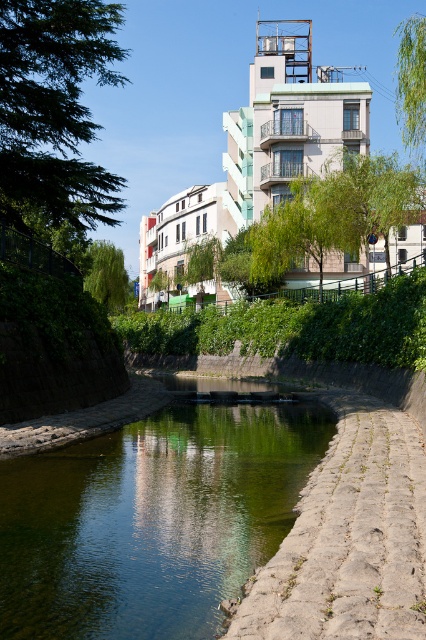
Question: Is the position of green leafy tree at upper left less distant than that of green leafy tree at upper right?

Choices:
 (A) no
 (B) yes

Answer: (B)

Question: Estimate the real-world distances between objects in this image. Which object is farther from the green leafy tree at upper right?

Choices:
 (A) green leafy tree at left
 (B) green leafy tree at upper left
 (C) green smooth water at center

Answer: (A)

Question: Can you confirm if green smooth water at center is wider than stone textured path at lower right?

Choices:
 (A) yes
 (B) no

Answer: (A)

Question: Is green leafy tree at upper left smaller than green leafy tree at upper right?

Choices:
 (A) no
 (B) yes

Answer: (B)

Question: Which point appears farthest from the camera in this image?

Choices:
 (A) (88, 192)
 (B) (351, 458)
 (C) (121, 292)

Answer: (C)

Question: Which point is closer to the camera taking this photo?

Choices:
 (A) (92, 273)
 (B) (419, 20)

Answer: (B)